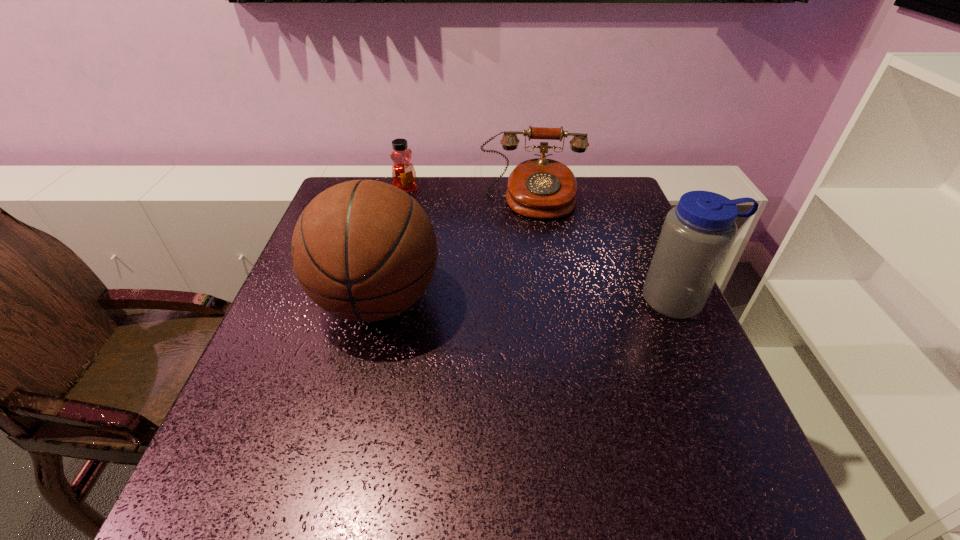
Find the location of a particular element. free spot on the desktop that is between the basketball and the rightmost object and is positioned on the front label of the honey is located at coordinates (499, 300).

Identify the location of vacant spot on the desktop that is between the basketball and the water bottle and is positioned on the dial of the second object from right to left. The image size is (960, 540). (537, 300).